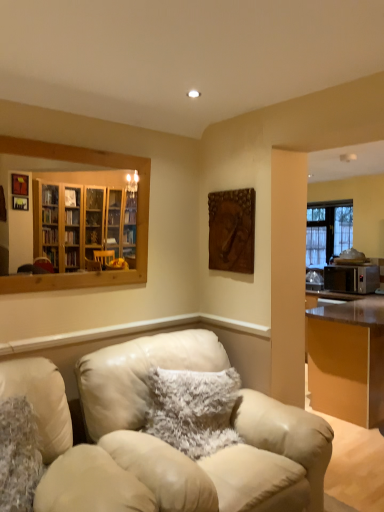
Question: Is metallic brown desk at right inside the boundaries of wooden frame mirror at upper left, or outside?

Choices:
 (A) outside
 (B) inside

Answer: (A)

Question: From their relative heights in the image, would you say metallic brown desk at right is taller or shorter than wooden frame mirror at upper left?

Choices:
 (A) short
 (B) tall

Answer: (B)

Question: Considering the real-world distances, which object is farthest from the fuzzy white pillow at center, which is counted as the second pillow, starting from the left?

Choices:
 (A) wooden frame mirror at upper left
 (B) fuzzy fabric pillow at lower left, which is the 2th pillow in back-to-front order
 (C) brown textured plaque at upper center
 (D) leather couch at center
 (E) metallic brown desk at right

Answer: (E)

Question: Which of these objects is positioned farthest from the wooden frame mirror at upper left?

Choices:
 (A) leather chair at center
 (B) leather couch at center
 (C) metallic brown desk at right
 (D) fuzzy white pillow at center, arranged as the 1th pillow when viewed from the right
 (E) fuzzy fabric pillow at lower left, the second pillow positioned from the right

Answer: (C)